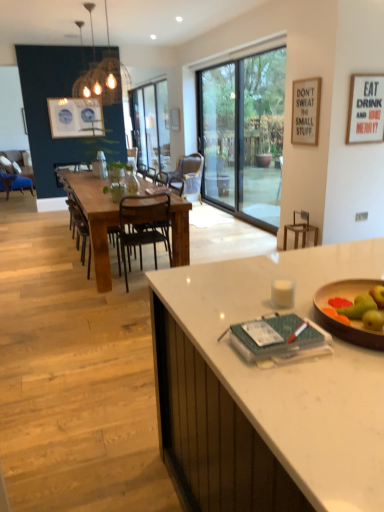
I want to click on vacant space behind wooden bowl at center, so click(x=311, y=275).